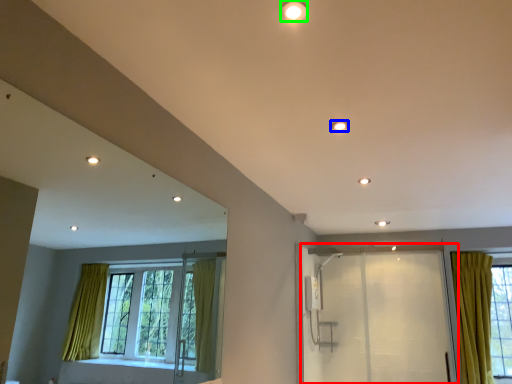
Question: Based on their relative distances, which object is farther from screen door (highlighted by a red box)? Choose from lighting (highlighted by a blue box) and lighting (highlighted by a green box).

Choices:
 (A) lighting
 (B) lighting

Answer: (B)